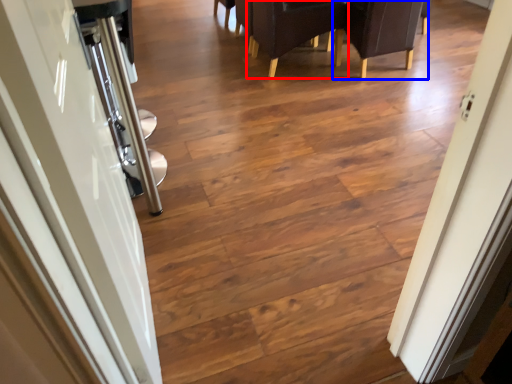
Question: Among these objects, which one is nearest to the camera, armchair (highlighted by a red box) or armchair (highlighted by a blue box)?

Choices:
 (A) armchair
 (B) armchair

Answer: (B)